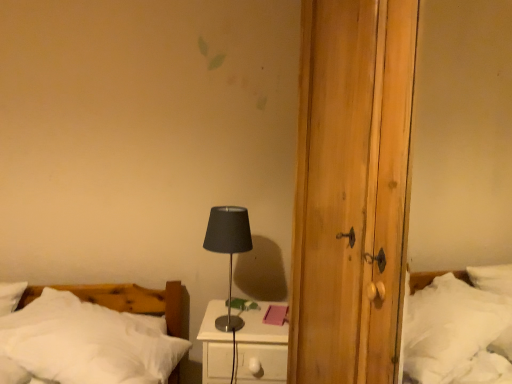
What do you see at coordinates (262, 349) in the screenshot?
I see `white glossy nightstand at center` at bounding box center [262, 349].

Locate an element on the screen. The image size is (512, 384). white glossy nightstand at center is located at coordinates (262, 349).

How distant is black metallic table lamp at center from white glossy nightstand at center?

black metallic table lamp at center and white glossy nightstand at center are 14.74 inches apart.

Does black metallic table lamp at center come in front of white glossy nightstand at center?

Yes, black metallic table lamp at center is closer to the camera.

Between black metallic table lamp at center and white glossy nightstand at center, which one appears on the left side from the viewer's perspective?

black metallic table lamp at center.

How many degrees apart are the facing directions of white soft bed at lower left and white glossy nightstand at center?

The angle between the facing direction of white soft bed at lower left and the facing direction of white glossy nightstand at center is 10.2 degrees.

Based on the photo, does white soft bed at lower left turn towards white glossy nightstand at center?

No, white soft bed at lower left does not turn towards white glossy nightstand at center.

Is white soft bed at lower left not close to white glossy nightstand at center?

They are positioned close to each other.

In the scene shown: Is white soft bed at lower left inside the boundaries of white glossy nightstand at center, or outside?

white soft bed at lower left is spatially situated outside white glossy nightstand at center.

Based on the photo, from a real-world perspective, which object stands above the other?

black metallic table lamp at center, from a real-world perspective.

Relative to black metallic table lamp at center, is white glossy nightstand at center in front or behind?

Visually, white glossy nightstand at center is located behind black metallic table lamp at center.

How far apart are white glossy nightstand at center and black metallic table lamp at center?

white glossy nightstand at center is 14.74 inches from black metallic table lamp at center.

Between white glossy nightstand at center and black metallic table lamp at center, which one has larger size?

Bigger between the two is white glossy nightstand at center.

From a real-world perspective, who is located lower, white soft bed at lower left or black metallic table lamp at center?

In real-world perspective, white soft bed at lower left is lower.

Can you confirm if white soft bed at lower left is wider than black metallic table lamp at center?

Correct, the width of white soft bed at lower left exceeds that of black metallic table lamp at center.

Which is more to the right, white soft bed at lower left or black metallic table lamp at center?

From the viewer's perspective, black metallic table lamp at center appears more on the right side.

Between white soft bed at lower left and black metallic table lamp at center, which one is positioned in front?

white soft bed at lower left is more forward.

Does black metallic table lamp at center appear on the right side of white soft bed at lower left?

Yes.

Looking at their sizes, would you say black metallic table lamp at center is wider or thinner than white soft bed at lower left?

black metallic table lamp at center is thinner than white soft bed at lower left.

From a real-world perspective, which is physically below, black metallic table lamp at center or white soft bed at lower left?

white soft bed at lower left is physically lower.

At what (x,y) coordinates should I click in order to perform the action: click on bed that appears below the black metallic table lamp at center (from the image's perspective). Please return your answer as a coordinate pair (x, y). Looking at the image, I should click on (84, 344).

What's the angular difference between white glossy nightstand at center and white soft bed at lower left's facing directions?

They differ by 10.2 degrees in their facing directions.

Which of these two, white glossy nightstand at center or white soft bed at lower left, is bigger?

white soft bed at lower left is bigger.

Is white glossy nightstand at center aimed at white soft bed at lower left?

No.

In terms of height, does white glossy nightstand at center look taller or shorter compared to white soft bed at lower left?

In the image, white glossy nightstand at center appears to be taller than white soft bed at lower left.

Where is `nightstand behind the black metallic table lamp at center`? The image size is (512, 384). nightstand behind the black metallic table lamp at center is located at coordinates (262, 349).

Locate an element on the screen. The width and height of the screenshot is (512, 384). bed located above the white glossy nightstand at center (from a real-world perspective) is located at coordinates (84, 344).

Looking at the image, which one is located further to white glossy nightstand at center, white soft bed at lower left or black metallic table lamp at center?

black metallic table lamp at center is positioned further to the anchor white glossy nightstand at center.

Looking at the image, which one is located further to black metallic table lamp at center, white soft bed at lower left or white glossy nightstand at center?

The object further to black metallic table lamp at center is white soft bed at lower left.

Which object lies nearer to the anchor point black metallic table lamp at center, white glossy nightstand at center or white soft bed at lower left?

Among the two, white glossy nightstand at center is located nearer to black metallic table lamp at center.

Estimate the real-world distances between objects in this image. Which object is further from white glossy nightstand at center, black metallic table lamp at center or white soft bed at lower left?

Among the two, black metallic table lamp at center is located further to white glossy nightstand at center.

From the image, which object appears to be nearer to white soft bed at lower left, black metallic table lamp at center or white glossy nightstand at center?

white glossy nightstand at center is closer to white soft bed at lower left.

Consider the image. Based on their spatial positions, is white glossy nightstand at center or black metallic table lamp at center further from white soft bed at lower left?

black metallic table lamp at center lies further to white soft bed at lower left than the other object.

This screenshot has height=384, width=512. I want to click on table lamp situated between white soft bed at lower left and white glossy nightstand at center from left to right, so click(228, 249).